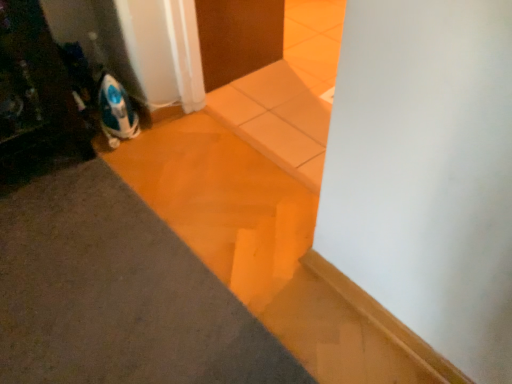
Describe the element at coordinates (117, 294) in the screenshot. This screenshot has width=512, height=384. I see `brown matte concrete at lower left` at that location.

The width and height of the screenshot is (512, 384). Find the location of `brown matte concrete at lower left`. brown matte concrete at lower left is located at coordinates (117, 294).

Find the location of `brown matte concrete at lower left`. brown matte concrete at lower left is located at coordinates (117, 294).